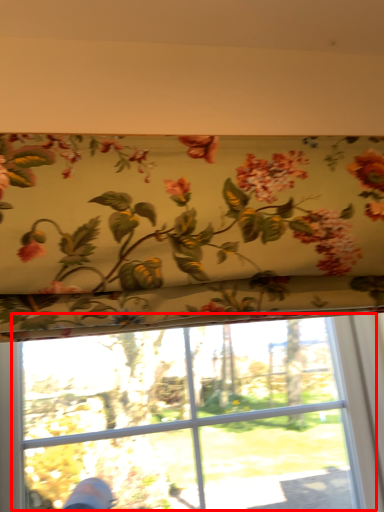
Question: From the image's perspective, where is bay window (annotated by the red box) located in relation to floral arrangement in the image?

Choices:
 (A) below
 (B) above

Answer: (A)